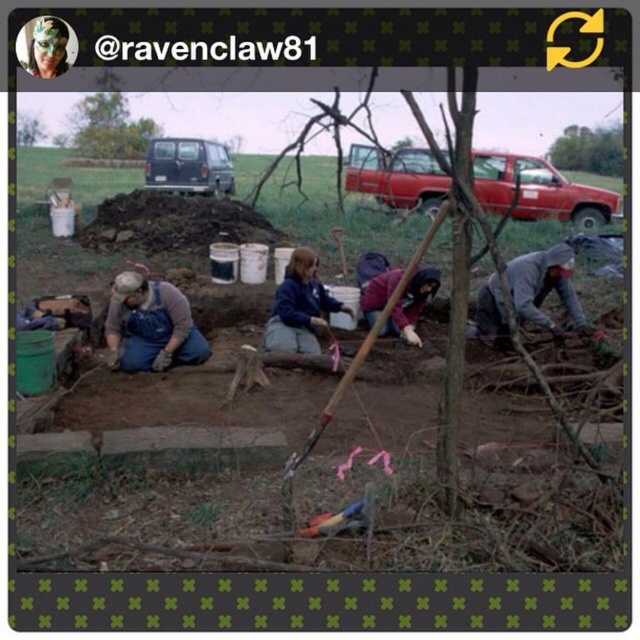
You are standing at the center of the image and want to move to the blue denim overalls at lower left. Which direction should you move in?

The blue denim overalls at lower left is located at point (150, 324), so you should move to the lower left direction to reach it.

You are standing at the center of the image and want to pick up the gray matte jacket at lower right. Which direction should you move to reach it?

The gray matte jacket at lower right is located at point (544,285), so you should move to the lower right direction to reach it.